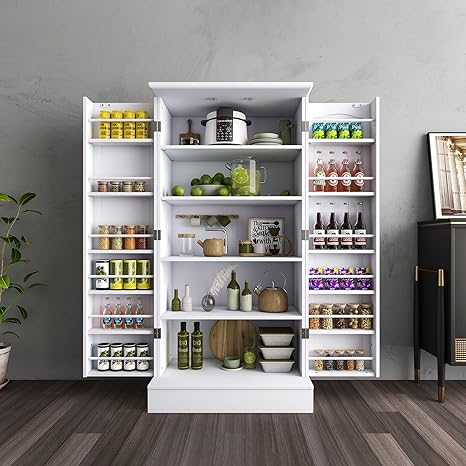
At what (x,y) coordinates should I click in order to perform the action: click on green and blue containers on top right shelf. Please return your answer as a coordinate pair (x, y). The width and height of the screenshot is (466, 466). Looking at the image, I should click on (317, 129), (330, 131), (344, 130), (356, 130).